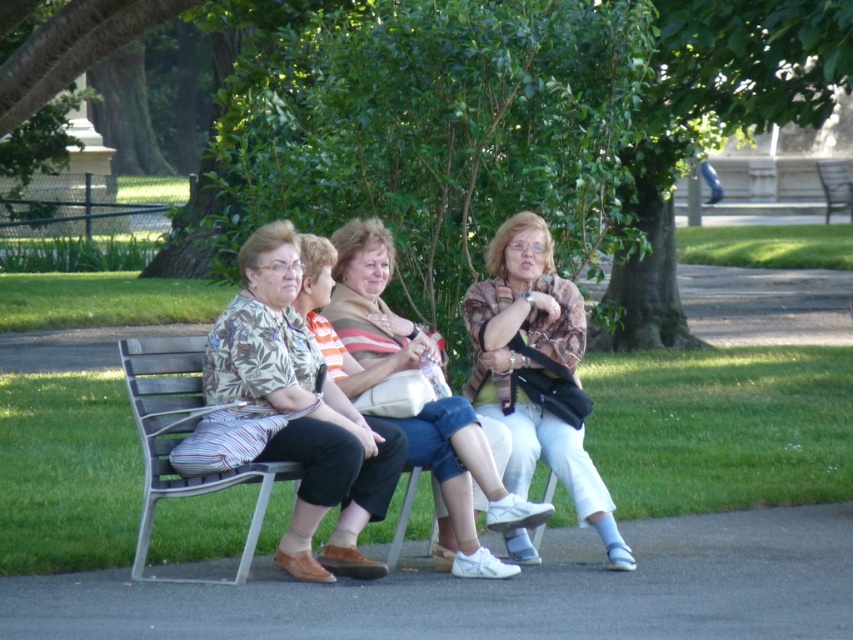
Who is positioned more to the right, printed fabric blouse at center or patterned fabric purse at center?

Positioned to the right is patterned fabric purse at center.

Which is behind, point (346, 538) or point (517, 371)?

The point (517, 371) is more distant.

Where is `printed fabric blouse at center`? printed fabric blouse at center is located at coordinates (335, 484).

Does patterned fabric purse at center have a smaller size compared to wooden park bench at right?

Indeed, patterned fabric purse at center has a smaller size compared to wooden park bench at right.

Who is higher up, patterned fabric purse at center or wooden park bench at right?

wooden park bench at right is higher up.

Which is in front, point (573, 348) or point (836, 177)?

Point (573, 348)

What are the coordinates of `patterned fabric purse at center` in the screenshot? It's located at (534, 368).

Can you confirm if patterned fabric purse at center is positioned to the left of striped fabric purse at center?

In fact, patterned fabric purse at center is to the right of striped fabric purse at center.

Which is behind, point (485, 390) or point (347, 230)?

Positioned behind is point (485, 390).

You are a GUI agent. You are given a task and a screenshot of the screen. Output one action in this format:
    pyautogui.click(x=<x>, y=<y>)
    Task: Click on the patterned fabric purse at center
    Image resolution: width=853 pixels, height=640 pixels.
    Given the screenshot: What is the action you would take?
    pyautogui.click(x=534, y=368)